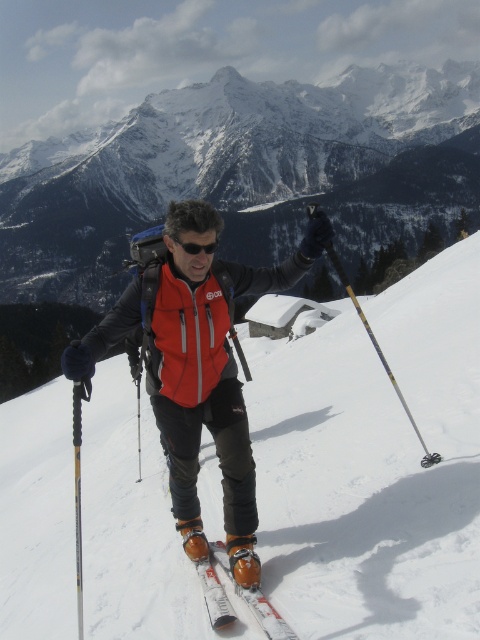
You are a photographer trying to capture the skier in the image. You want to focus on the white metallic skis at center and the black plastic goggles at center. Which object should you adjust your camera focus to first to ensure both are in the frame?

The white metallic skis at center is closer to the viewer than the black plastic goggles at center, so you should focus on the white metallic skis at center first to ensure both are in the frame.

You are a drone operator trying to capture a photo of the skier. You need to focus on two specific points marked in the image. Which point, point 1 at coordinates point (272, 609) or point 2 at coordinates point (193, 243), should you adjust your focus on first to ensure the skier is sharp in the photo?

Point 1 at coordinates point (272, 609) should be focused on first because it is closer to the camera and will ensure the skier is in sharp focus.